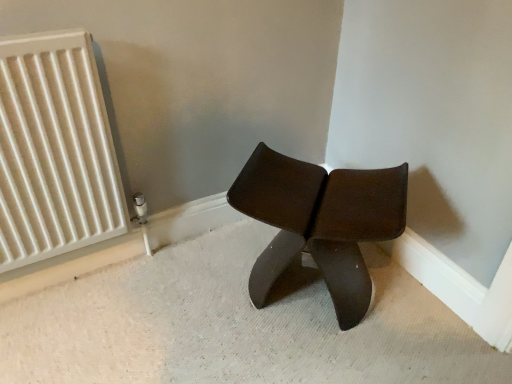
I want to click on free space to the left of matte brown stool at center, so click(x=200, y=293).